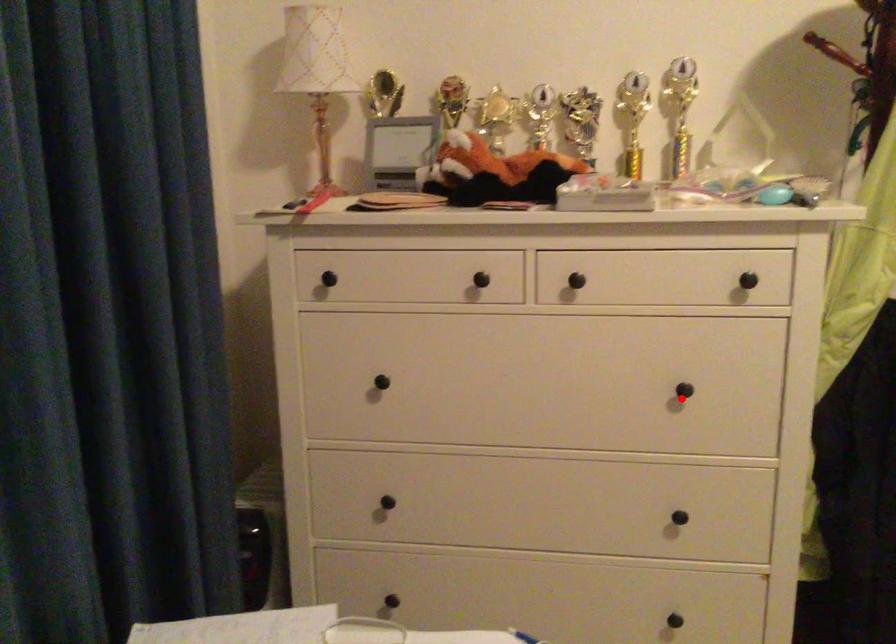
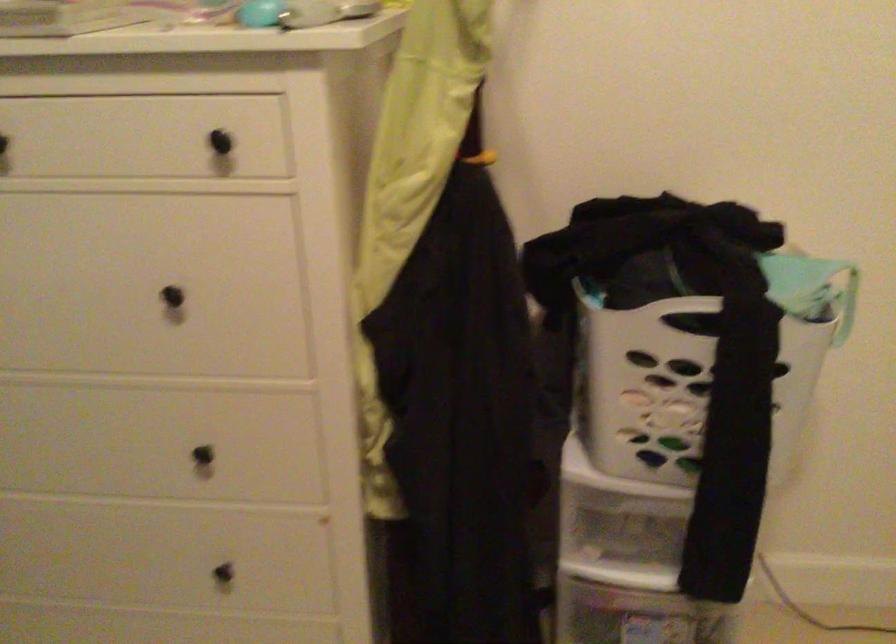
Question: I am providing you with two images of the same scene from different viewpoints. A red point is shown in image1. For the corresponding object point in image2, is it positioned nearer or farther from the camera?

Choices:
 (A) Nearer
 (B) Farther

Answer: (A)